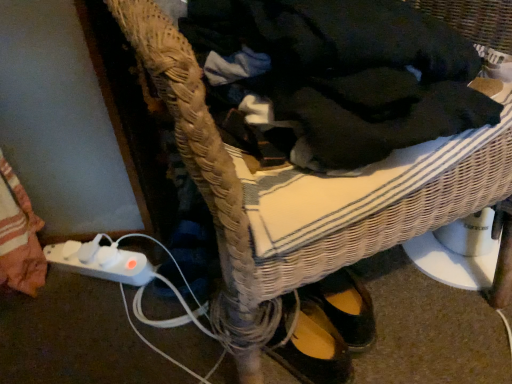
Question: From a real-world perspective, is white plastic plug at lower left below dark woven fabric at center?

Choices:
 (A) no
 (B) yes

Answer: (B)

Question: Is white plastic plug at lower left thinner than dark woven fabric at center?

Choices:
 (A) no
 (B) yes

Answer: (B)

Question: Does white plastic plug at lower left appear on the right side of dark woven fabric at center?

Choices:
 (A) no
 (B) yes

Answer: (A)

Question: Can you confirm if white plastic plug at lower left is smaller than dark woven fabric at center?

Choices:
 (A) yes
 (B) no

Answer: (A)

Question: Can you confirm if white plastic plug at lower left is taller than dark woven fabric at center?

Choices:
 (A) no
 (B) yes

Answer: (A)

Question: Is white plastic plug at lower left not close to dark woven fabric at center?

Choices:
 (A) yes
 (B) no

Answer: (B)

Question: Can you confirm if dark woven fabric at center is shorter than white plastic plug at lower left?

Choices:
 (A) yes
 (B) no

Answer: (B)

Question: From a real-world perspective, is dark woven fabric at center located beneath white plastic plug at lower left?

Choices:
 (A) no
 (B) yes

Answer: (A)

Question: Is dark woven fabric at center oriented towards white plastic plug at lower left?

Choices:
 (A) no
 (B) yes

Answer: (A)

Question: From a real-world perspective, is dark woven fabric at center positioned over white plastic plug at lower left based on gravity?

Choices:
 (A) yes
 (B) no

Answer: (A)

Question: Is white plastic plug at lower left inside dark woven fabric at center?

Choices:
 (A) no
 (B) yes

Answer: (A)

Question: Does dark woven fabric at center come in front of white plastic plug at lower left?

Choices:
 (A) no
 (B) yes

Answer: (B)

Question: From the image's perspective, relative to dark woven fabric at center, is white plastic plug at lower left above or below?

Choices:
 (A) above
 (B) below

Answer: (B)